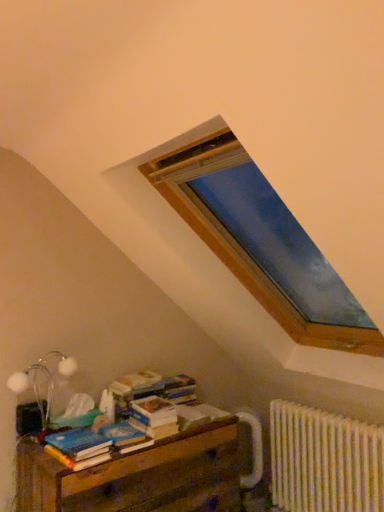
Question: From the image's perspective, does wooden at lower left appear higher than white matte table lamp at lower left?

Choices:
 (A) no
 (B) yes

Answer: (A)

Question: Is there a large distance between wooden at lower left and white matte table lamp at lower left?

Choices:
 (A) yes
 (B) no

Answer: (B)

Question: Is wooden at lower left touching white matte table lamp at lower left?

Choices:
 (A) no
 (B) yes

Answer: (A)

Question: Is wooden at lower left facing away from white matte table lamp at lower left?

Choices:
 (A) yes
 (B) no

Answer: (B)

Question: Does wooden at lower left come in front of white matte table lamp at lower left?

Choices:
 (A) no
 (B) yes

Answer: (B)

Question: Is the depth of wooden at lower left greater than that of white matte table lamp at lower left?

Choices:
 (A) no
 (B) yes

Answer: (A)

Question: From a real-world perspective, is blue matte paperback book at lower left, the second paperback book positioned from the left, under wooden at lower left?

Choices:
 (A) yes
 (B) no

Answer: (B)

Question: Can you confirm if blue matte paperback book at lower left, which ranks as the 2th paperback book in right-to-left order, is smaller than wooden at lower left?

Choices:
 (A) yes
 (B) no

Answer: (A)

Question: Is blue matte paperback book at lower left, which ranks as the 2th paperback book in right-to-left order, bigger than wooden at lower left?

Choices:
 (A) no
 (B) yes

Answer: (A)

Question: Does blue matte paperback book at lower left, the second paperback book positioned from the left, have a lesser height compared to wooden at lower left?

Choices:
 (A) no
 (B) yes

Answer: (B)

Question: Would you say blue matte paperback book at lower left, which ranks as the 2th paperback book in right-to-left order, is outside wooden at lower left?

Choices:
 (A) no
 (B) yes

Answer: (B)

Question: Does blue matte paperback book at lower left, the second paperback book positioned from the left, contain wooden at lower left?

Choices:
 (A) yes
 (B) no

Answer: (B)

Question: Is blue matte paperback book at lower left, which ranks as the 2th paperback book in right-to-left order, positioned before white textured radiator at lower right?

Choices:
 (A) yes
 (B) no

Answer: (A)